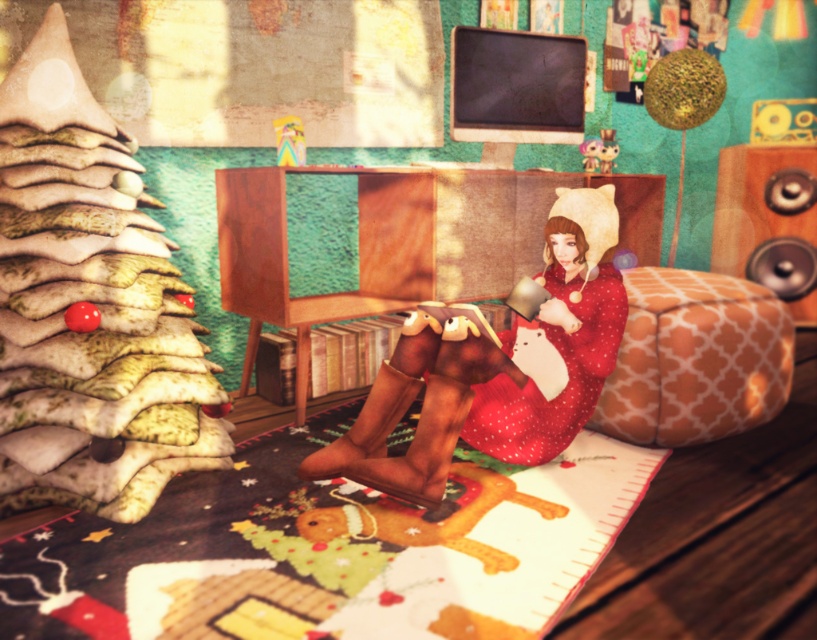
Question: Can you confirm if matte red dress at center is smaller than red dotted fabric dress at center?

Choices:
 (A) yes
 (B) no

Answer: (B)

Question: Which point appears closest to the camera in this image?

Choices:
 (A) (423, 452)
 (B) (813, 163)
 (C) (583, 314)

Answer: (A)

Question: Is matte red dress at center to the left of metallic silver speaker at right from the viewer's perspective?

Choices:
 (A) no
 (B) yes

Answer: (B)

Question: Is matte red dress at center to the right of metallic silver speaker at right from the viewer's perspective?

Choices:
 (A) yes
 (B) no

Answer: (B)

Question: Which object is positioned closest to the metallic silver speaker at right?

Choices:
 (A) matte red dress at center
 (B) red dotted fabric dress at center

Answer: (B)

Question: Which of the following is the farthest from the observer?

Choices:
 (A) metallic silver speaker at right
 (B) matte red dress at center
 (C) red dotted fabric dress at center

Answer: (A)